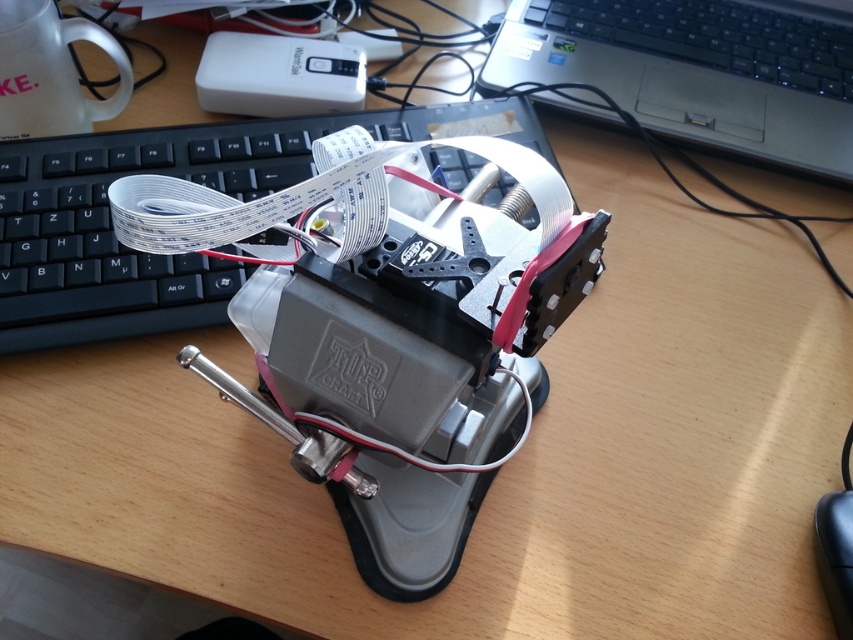
Which of these two, silver metallic laptop at upper right or black plastic mouse at lower right, stands shorter?

With less height is black plastic mouse at lower right.

Is silver metallic laptop at upper right to the right of black plastic mouse at lower right from the viewer's perspective?

In fact, silver metallic laptop at upper right is to the left of black plastic mouse at lower right.

Which is behind, point (782, 58) or point (822, 531)?

Point (782, 58)

Locate an element on the screen. The height and width of the screenshot is (640, 853). silver metallic laptop at upper right is located at coordinates (699, 68).

Is black plastic keyboard at center to the left of silver metallic laptop at upper right from the viewer's perspective?

Indeed, black plastic keyboard at center is positioned on the left side of silver metallic laptop at upper right.

Is point (194, 289) in front of point (643, 4)?

Yes.

Locate an element on the screen. Image resolution: width=853 pixels, height=640 pixels. black plastic keyboard at center is located at coordinates (178, 177).

Identify the location of black plastic keyboard at center. This screenshot has height=640, width=853. (178, 177).

Does black plastic keyboard at center lie behind black plastic mouse at lower right?

That is True.

Does point (154, 136) come in front of point (839, 636)?

No.

Identify the location of black plastic keyboard at center. This screenshot has height=640, width=853. (178, 177).